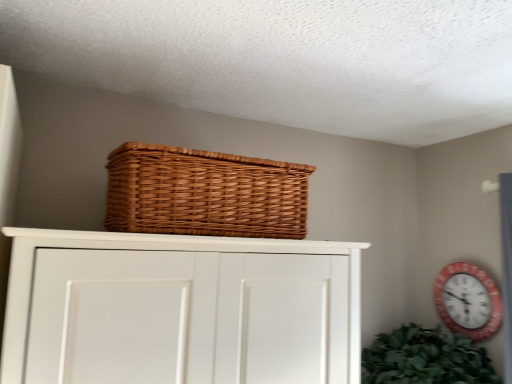
Question: Can you confirm if red plastic wall clock at upper right is smaller than woven brown basket at upper center?

Choices:
 (A) no
 (B) yes

Answer: (B)

Question: Can you confirm if red plastic wall clock at upper right is positioned to the left of woven brown basket at upper center?

Choices:
 (A) yes
 (B) no

Answer: (B)

Question: From a real-world perspective, is red plastic wall clock at upper right on woven brown basket at upper center?

Choices:
 (A) no
 (B) yes

Answer: (A)

Question: Is red plastic wall clock at upper right oriented away from woven brown basket at upper center?

Choices:
 (A) yes
 (B) no

Answer: (B)

Question: From the image's perspective, is red plastic wall clock at upper right located beneath woven brown basket at upper center?

Choices:
 (A) no
 (B) yes

Answer: (B)

Question: Is red plastic wall clock at upper right closer to camera compared to woven brown basket at upper center?

Choices:
 (A) yes
 (B) no

Answer: (B)

Question: Is woven brown basket at upper center closer to camera compared to red plastic wall clock at upper right?

Choices:
 (A) yes
 (B) no

Answer: (A)

Question: Is woven brown basket at upper center facing away from red plastic wall clock at upper right?

Choices:
 (A) no
 (B) yes

Answer: (A)

Question: Can you confirm if woven brown basket at upper center is shorter than red plastic wall clock at upper right?

Choices:
 (A) yes
 (B) no

Answer: (A)

Question: Is woven brown basket at upper center facing towards red plastic wall clock at upper right?

Choices:
 (A) yes
 (B) no

Answer: (B)

Question: Is woven brown basket at upper center located outside red plastic wall clock at upper right?

Choices:
 (A) yes
 (B) no

Answer: (A)

Question: Can you confirm if woven brown basket at upper center is bigger than red plastic wall clock at upper right?

Choices:
 (A) no
 (B) yes

Answer: (B)

Question: Is woven brown basket at upper center inside the boundaries of red plastic wall clock at upper right, or outside?

Choices:
 (A) inside
 (B) outside

Answer: (B)